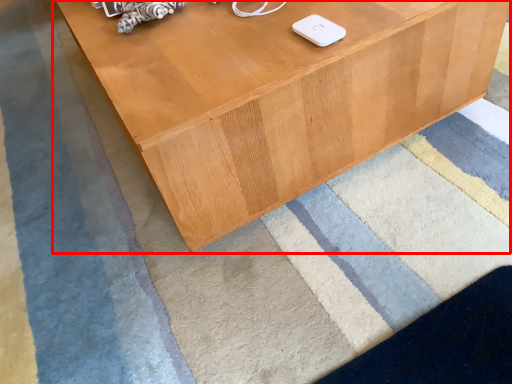
Question: Considering the relative positions of table (annotated by the red box) and ipod in the image provided, where is table (annotated by the red box) located with respect to the staircase?

Choices:
 (A) right
 (B) left

Answer: (B)